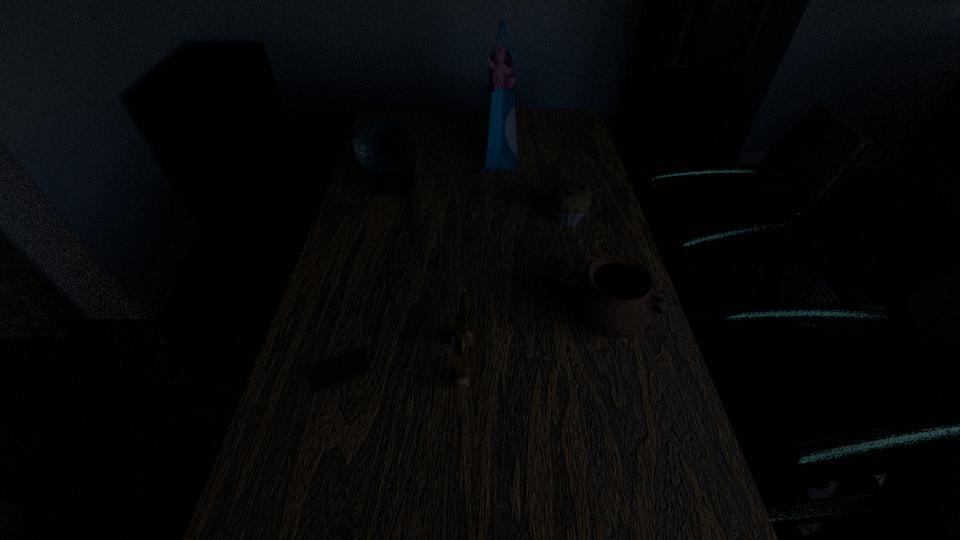
Identify the location of the fourth object from left to right. (499, 133).

The image size is (960, 540). I want to click on shopping bag, so click(499, 133).

You are a GUI agent. You are given a task and a screenshot of the screen. Output one action in this format:
    pyautogui.click(x=<x>, y=<y>)
    Task: Click on the phonograph_record
    The height and width of the screenshot is (540, 960).
    Given the screenshot: What is the action you would take?
    pyautogui.click(x=382, y=145)

You are a GUI agent. You are given a task and a screenshot of the screen. Output one action in this format:
    pyautogui.click(x=<x>, y=<y>)
    Task: Click on the earphone
    Image resolution: width=960 pixels, height=540 pixels.
    Given the screenshot: What is the action you would take?
    pyautogui.click(x=460, y=376)

The height and width of the screenshot is (540, 960). In order to click on pottery in this screenshot , I will do `click(614, 297)`.

The width and height of the screenshot is (960, 540). Find the location of `the third farthest object`. the third farthest object is located at coordinates (570, 199).

Find the location of a particular element. This screenshot has height=540, width=960. the second shortest object is located at coordinates (570, 199).

The image size is (960, 540). I want to click on candy bar, so click(355, 365).

What are the coordinates of `vacant point located on the front of the tallest object` in the screenshot? It's located at (503, 211).

At what (x,y) coordinates should I click in order to perform the action: click on vacant region located 0.100m from the horn of the phonograph_record. Please return your answer as a coordinate pair (x, y). This screenshot has width=960, height=540. Looking at the image, I should click on (385, 226).